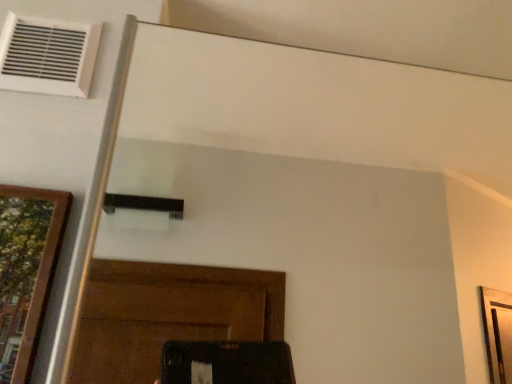
Question: Should I look upward or downward to see white plastic air conditioner at upper left?

Choices:
 (A) up
 (B) down

Answer: (A)